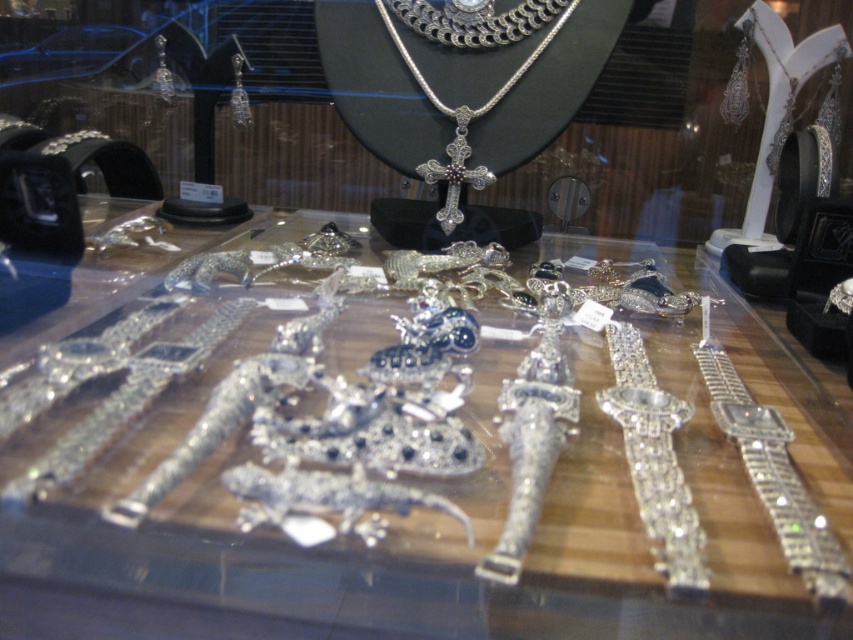
Does sparkling silver watch at center come behind shiny silver necklace at center?

That is True.

Does point (677, 522) come behind point (809, 534)?

Yes.

This screenshot has height=640, width=853. I want to click on sparkling silver watch at center, so click(x=654, y=458).

Is the position of shiny silver necklace at center less distant than that of silver/gemstone cross at center?

That is True.

Does shiny silver necklace at center have a larger size compared to silver/gemstone cross at center?

Indeed, shiny silver necklace at center has a larger size compared to silver/gemstone cross at center.

This screenshot has width=853, height=640. What are the coordinates of `shiny silver necklace at center` in the screenshot? It's located at (772, 470).

This screenshot has width=853, height=640. What are the coordinates of `shiny silver necklace at center` in the screenshot? It's located at [772, 470].

At what (x,y) coordinates should I click in order to perform the action: click on sparkling silver watch at center. Please return your answer as a coordinate pair (x, y). The image size is (853, 640). Looking at the image, I should click on (654, 458).

Where is `sparkling silver watch at center`? This screenshot has width=853, height=640. sparkling silver watch at center is located at coordinates (654, 458).